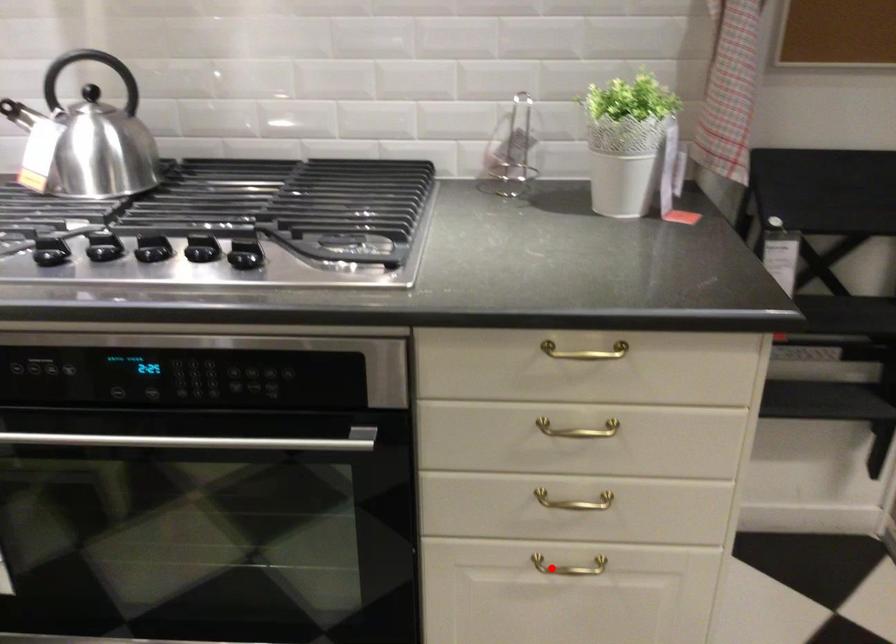
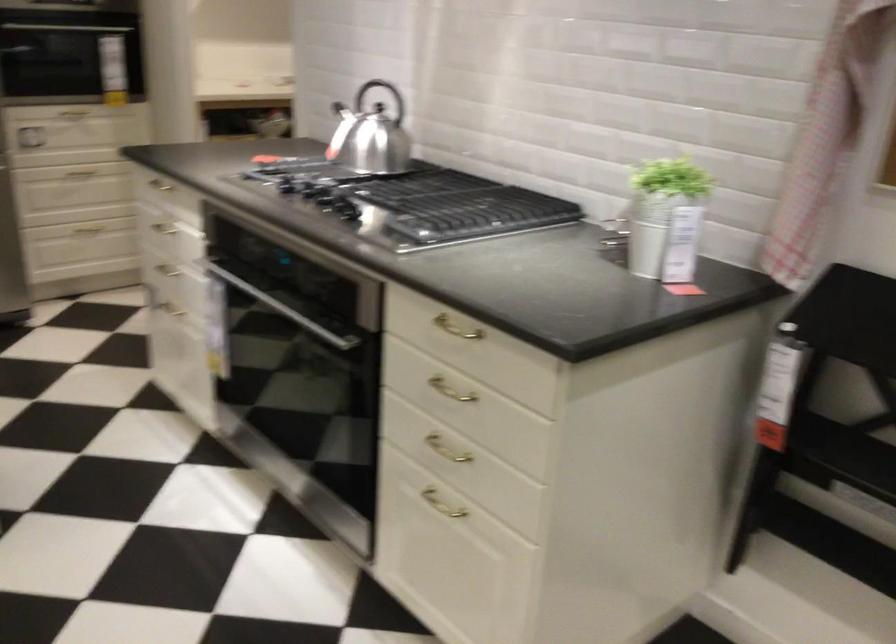
In the second image, find the point that corresponds to the highlighted location in the first image.

(442, 504)